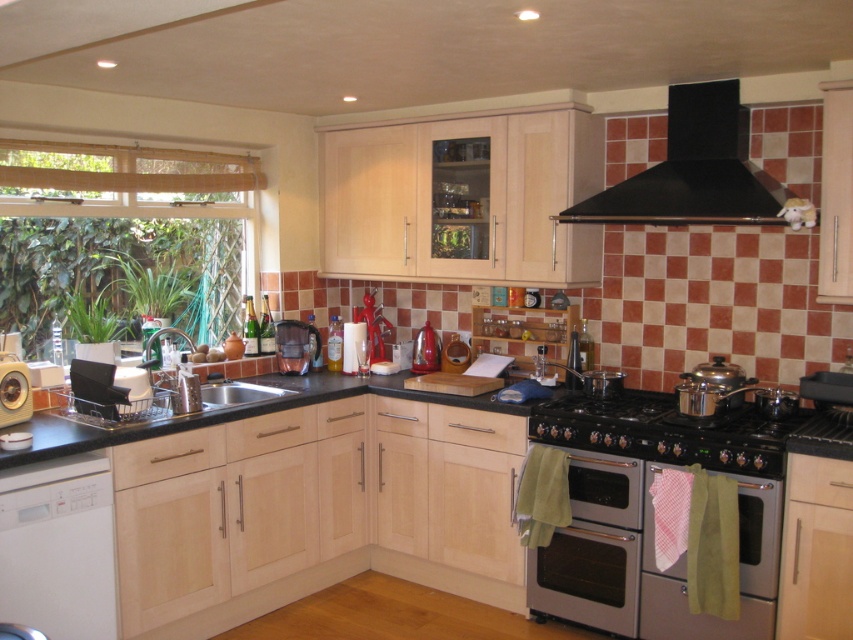
Is wooden blinds at left closer to camera compared to silver/stainless steel oven at lower right?

No, wooden blinds at left is further to the viewer.

Which is more to the right, wooden blinds at left or silver/stainless steel oven at lower right?

From the viewer's perspective, silver/stainless steel oven at lower right appears more on the right side.

Who is more forward, (223, 323) or (699, 634)?

Positioned in front is point (699, 634).

Find the location of `wooden blinds at left`. wooden blinds at left is located at coordinates (122, 236).

Is silver/stainless steel oven at lower right below white matte dishwasher at lower left?

Indeed, silver/stainless steel oven at lower right is positioned under white matte dishwasher at lower left.

Which is below, silver/stainless steel oven at lower right or white matte dishwasher at lower left?

silver/stainless steel oven at lower right is lower down.

Identify the location of silver/stainless steel oven at lower right. (646, 556).

Is the position of black matte exhaust hood at upper right more distant than that of matte silver washing machine at left?

No.

How much distance is there between black matte exhaust hood at upper right and matte silver washing machine at left?

They are 2.46 meters apart.

Between point (674, 129) and point (1, 390), which one is positioned in front?

Positioned in front is point (1, 390).

Where is `black matte exhaust hood at upper right`? black matte exhaust hood at upper right is located at coordinates (693, 170).